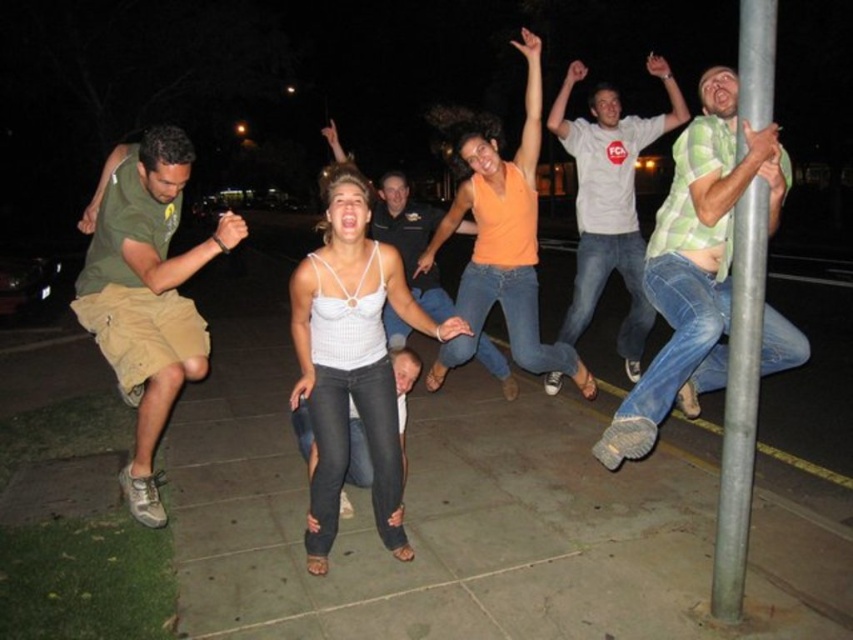
This screenshot has height=640, width=853. Describe the element at coordinates (351, 358) in the screenshot. I see `white knit tank top at center` at that location.

From the picture: Does white knit tank top at center have a larger size compared to brushed metal pole at right?

Correct, white knit tank top at center is larger in size than brushed metal pole at right.

Who is more distant from viewer, (379,332) or (724,600)?

The point (379,332) is behind.

Where is `white knit tank top at center`? white knit tank top at center is located at coordinates (351, 358).

Who is shorter, green plaid shirt at right or white tank top at center?

Standing shorter between the two is green plaid shirt at right.

Who is positioned more to the left, green plaid shirt at right or white tank top at center?

Positioned to the left is white tank top at center.

Locate an element on the screen. The height and width of the screenshot is (640, 853). green plaid shirt at right is located at coordinates (695, 262).

What do you see at coordinates (434, 512) in the screenshot? I see `gray concrete pavement at center` at bounding box center [434, 512].

Who is shorter, gray concrete pavement at center or orange sleeveless top at center?

gray concrete pavement at center is shorter.

Does point (349, 563) lie in front of point (473, 136)?

Yes, point (349, 563) is in front of point (473, 136).

Find the location of a particular element. The width and height of the screenshot is (853, 640). gray concrete pavement at center is located at coordinates (434, 512).